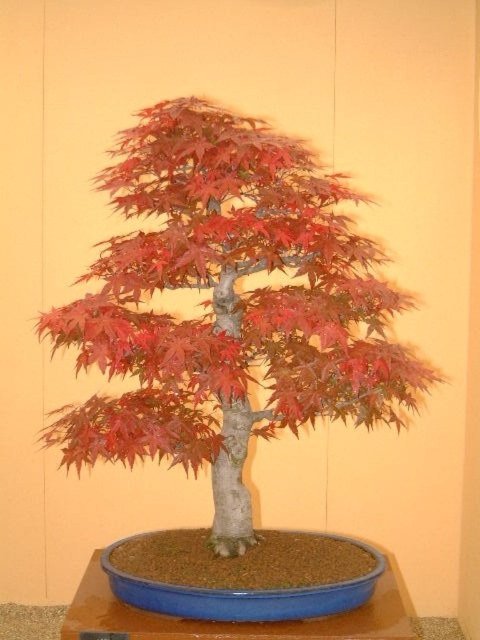
Is matte red bonsai tree at center shorter than blue plastic tray at center?

Incorrect, matte red bonsai tree at center's height does not fall short of blue plastic tray at center's.

Is point (316, 332) farther from viewer compared to point (362, 545)?

No, (316, 332) is closer to viewer.

Locate an element on the screen. matte red bonsai tree at center is located at coordinates (228, 307).